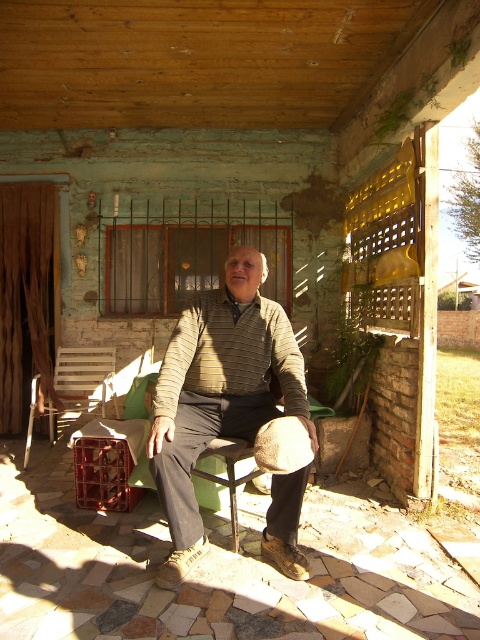
Question: Among these objects, which one is farthest from the camera?

Choices:
 (A) wooden slats chair at left
 (B) striped knit sweater at center

Answer: (A)

Question: Can you confirm if striped knit sweater at center is positioned to the left of wooden slats chair at left?

Choices:
 (A) yes
 (B) no

Answer: (B)

Question: Can you confirm if striped knit sweater at center is wider than wooden slats chair at left?

Choices:
 (A) no
 (B) yes

Answer: (B)

Question: Which point is farther from the camera taking this photo?

Choices:
 (A) (80, 376)
 (B) (279, 515)

Answer: (A)

Question: Is striped knit sweater at center wider than wooden slats chair at left?

Choices:
 (A) yes
 (B) no

Answer: (A)